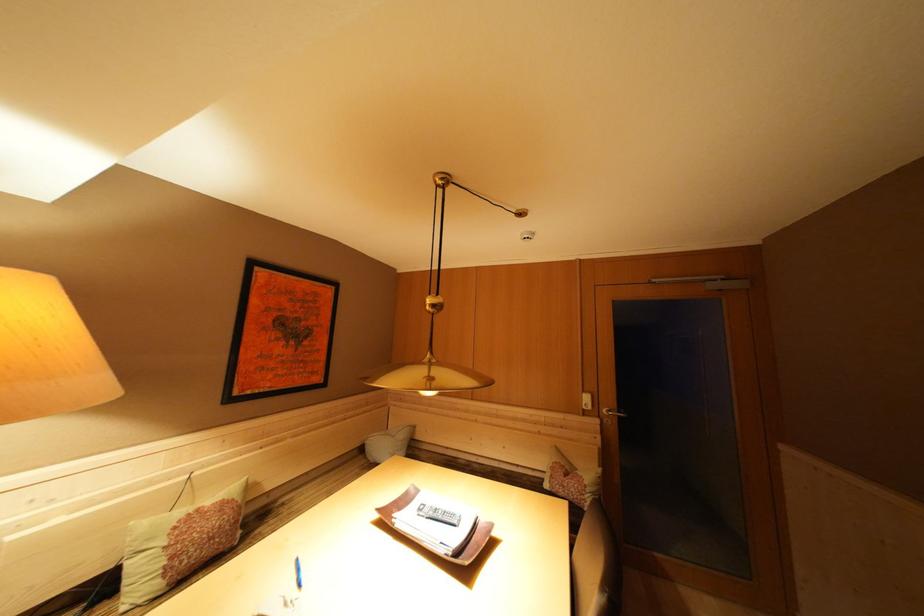
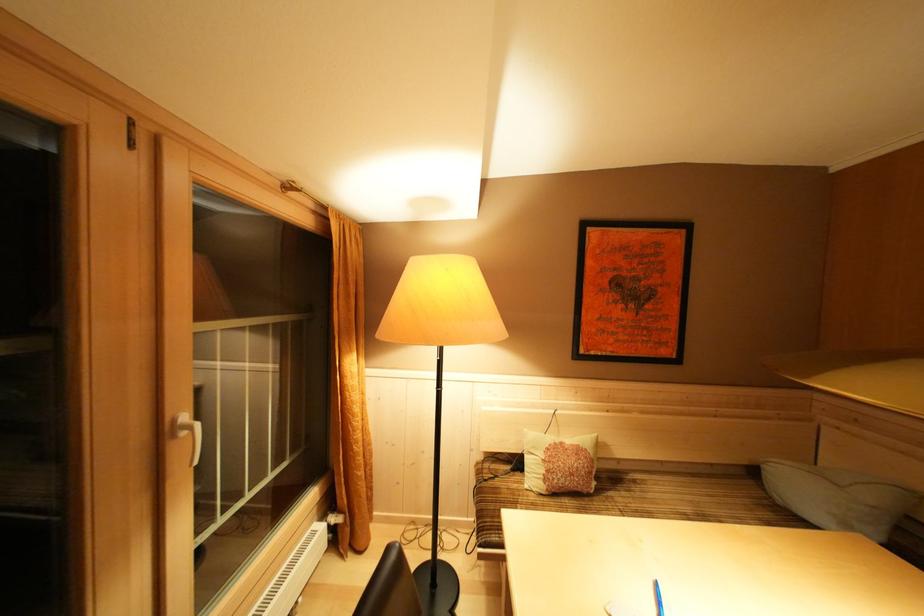
Question: The camera is either moving clockwise (left) or counter-clockwise (right) around the object. The first image is from the beginning of the video and the second image is from the end. Is the camera moving left or right when shooting the video?

Choices:
 (A) Left
 (B) Right

Answer: (B)